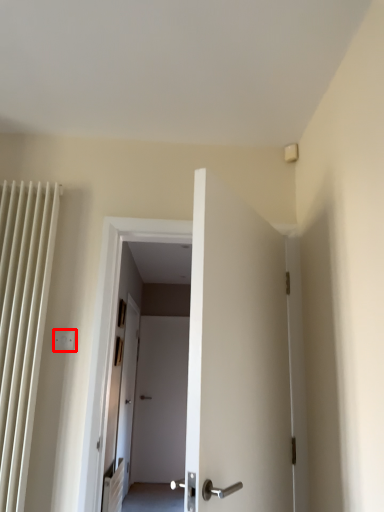
Question: Considering the relative positions of electric outlet (annotated by the red box) and path in the image provided, where is electric outlet (annotated by the red box) located with respect to the staircase?

Choices:
 (A) left
 (B) right

Answer: (A)